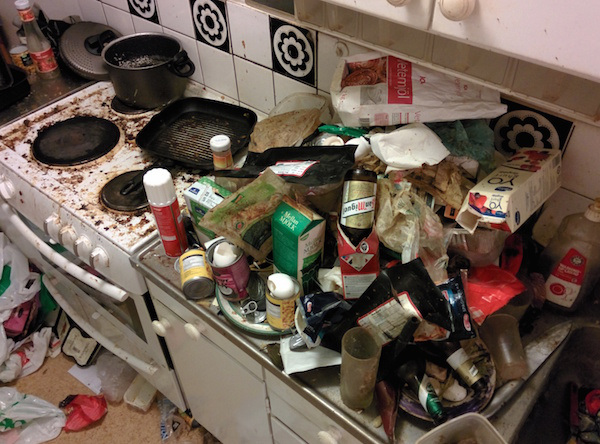
This screenshot has height=444, width=600. In order to click on black pot in this screenshot , I will do `click(145, 74)`.